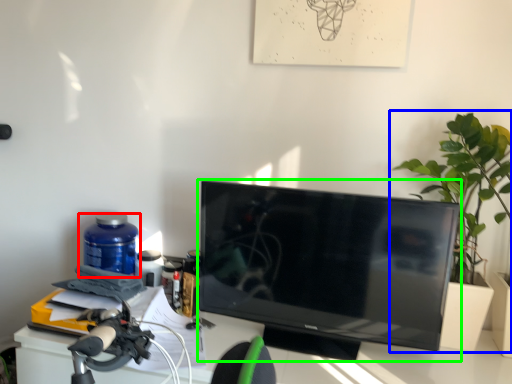
Question: Which object is positioned closest to bottle (highlighted by a red box)? Select from houseplant (highlighted by a blue box) and television (highlighted by a green box).

Choices:
 (A) houseplant
 (B) television

Answer: (B)